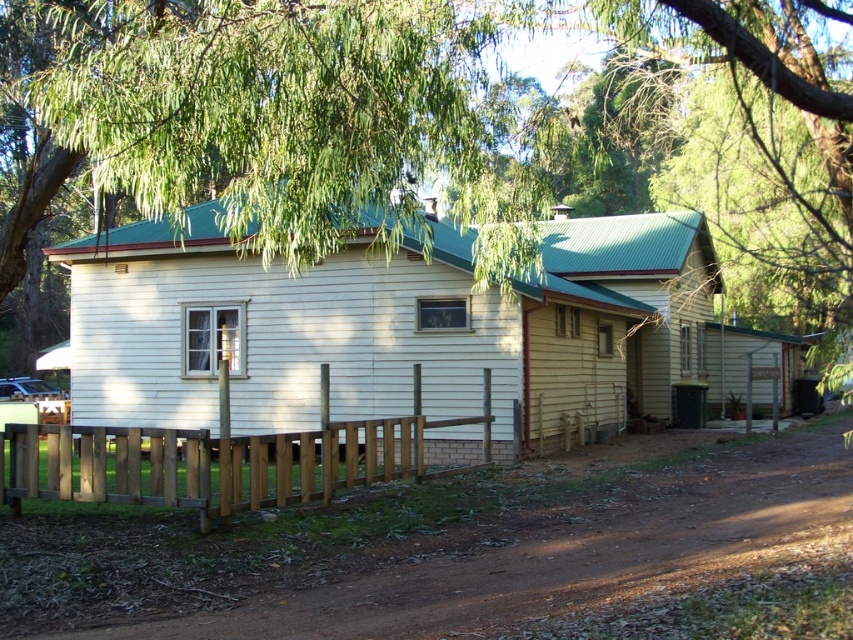
Question: Does brown dirt track at lower center appear on the right side of brown wooden fence at lower center?

Choices:
 (A) no
 (B) yes

Answer: (B)

Question: Is brown dirt track at lower center below brown wooden fence at lower center?

Choices:
 (A) yes
 (B) no

Answer: (A)

Question: Is brown dirt track at lower center below brown wooden fence at lower center?

Choices:
 (A) no
 (B) yes

Answer: (B)

Question: Which of the following is the farthest from the observer?

Choices:
 (A) brown wooden fence at lower center
 (B) brown dirt track at lower center

Answer: (A)